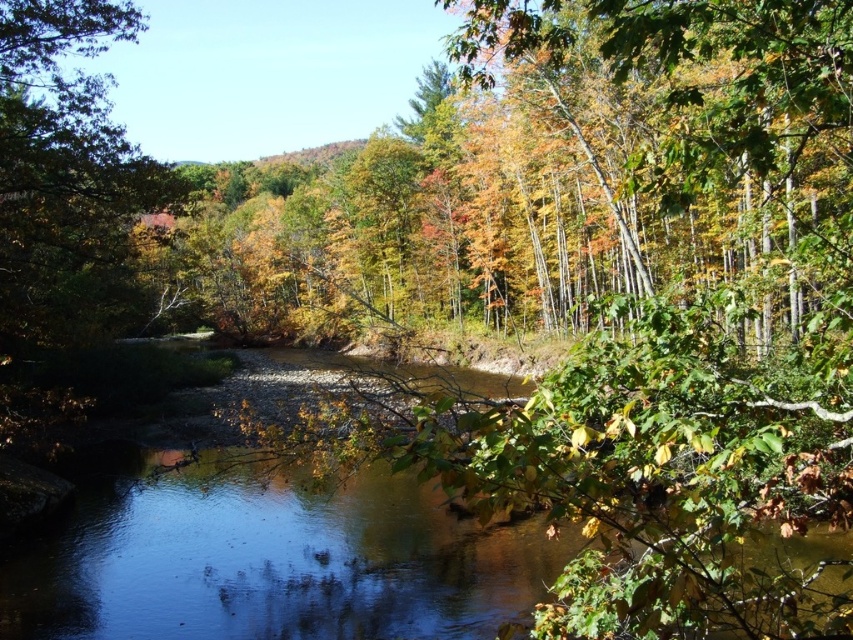
You are standing at the edge of the river and see the point labeled as point (273, 566). Based on the scene description, what is the nature of the water at that specific location?

The point (273, 566) corresponds to clear water at center, which is part of the serene river with calm surface reflecting the surrounding trees and sky, indicating it is a clear area of the river.

You are standing at the edge of the river and want to reach the green leafy tree at left. Which direction should you move to get closer to it without crossing the clear water at center?

You should move to the left side of the clear water at center to approach the green leafy tree at left, as the water is between you and the tree but the tree is further away from the viewer compared to the water.

You are standing at the point marked as point (413, 516) in the image. You want to cross the river to reach the opposite bank. The river is flowing from north to south. If you swim straight across, will you end up downstream or upstream of your starting point?

Since the river is flowing from north to south, swimming straight across would carry you downstream. Therefore, you would end up downstream of your starting point.